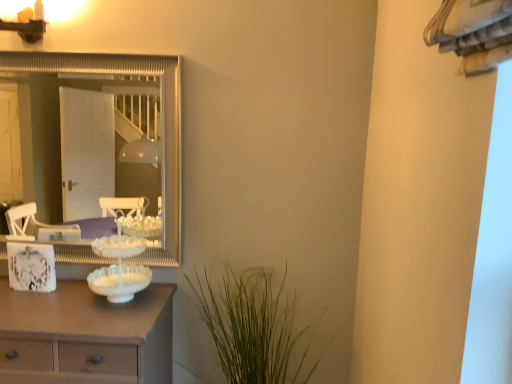
This screenshot has width=512, height=384. Identify the location of free spot in front of white frosted glass candle holder at center. (93, 323).